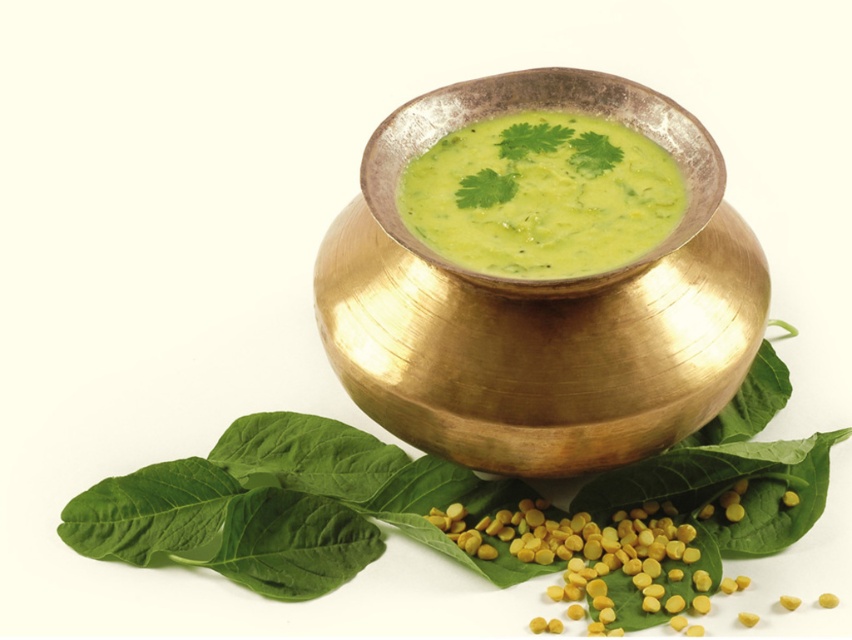
You are preparing a dish and need to arrange the green leafy basil at lower left and the green matte soup at center on a plate. Which one should you place first if you want the taller item to be in the center?

The green matte soup at center is taller than the green leafy basil at lower left, so you should place the green matte soup at center first to ensure it is in the center position.

You are a chef preparing a dish and need to serve the green matte soup at center. The gold metallic bowl at center is available. Can the soup fit into the bowl?

The gold metallic bowl at center has a larger size compared to green matte soup at center, so the soup can fit into the bowl.